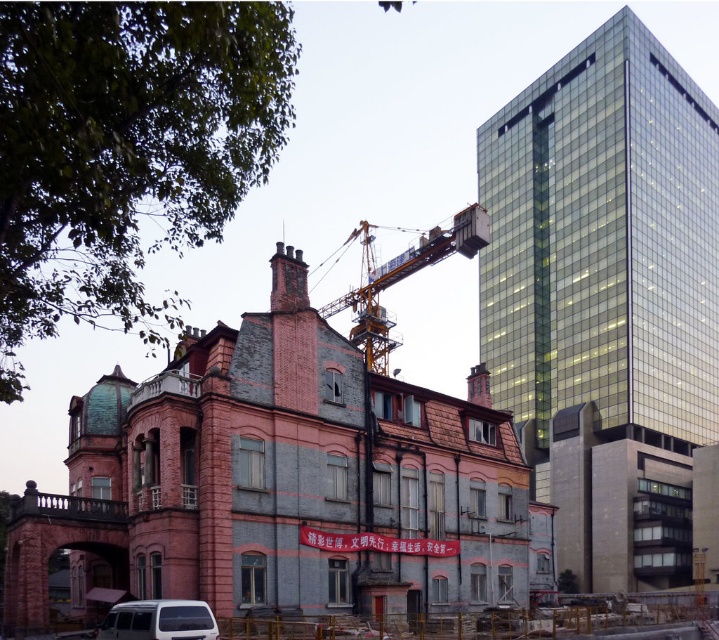
Which is above, yellow metallic crane at center or white matte van at lower left?

yellow metallic crane at center

Who is positioned more to the right, yellow metallic crane at center or white matte van at lower left?

yellow metallic crane at center is more to the right.

Identify the location of yellow metallic crane at center. The height and width of the screenshot is (640, 719). (400, 278).

Is point (270, 547) farther from viewer compared to point (146, 636)?

That is True.

Between point (262, 572) and point (155, 634), which one is positioned in front?

Positioned in front is point (155, 634).

Is point (35, 618) positioned before point (114, 632)?

No, (35, 618) is behind (114, 632).

Where is `pink brick building at center`? This screenshot has height=640, width=719. pink brick building at center is located at coordinates coord(278,483).

The image size is (719, 640). In order to click on pink brick building at center in this screenshot , I will do `click(278, 483)`.

Between pink brick building at center and yellow metallic crane at center, which one is positioned higher?

yellow metallic crane at center

Between point (315, 518) and point (464, 211), which one is positioned behind?

Point (464, 211)

Where is `pink brick building at center`? pink brick building at center is located at coordinates (278, 483).